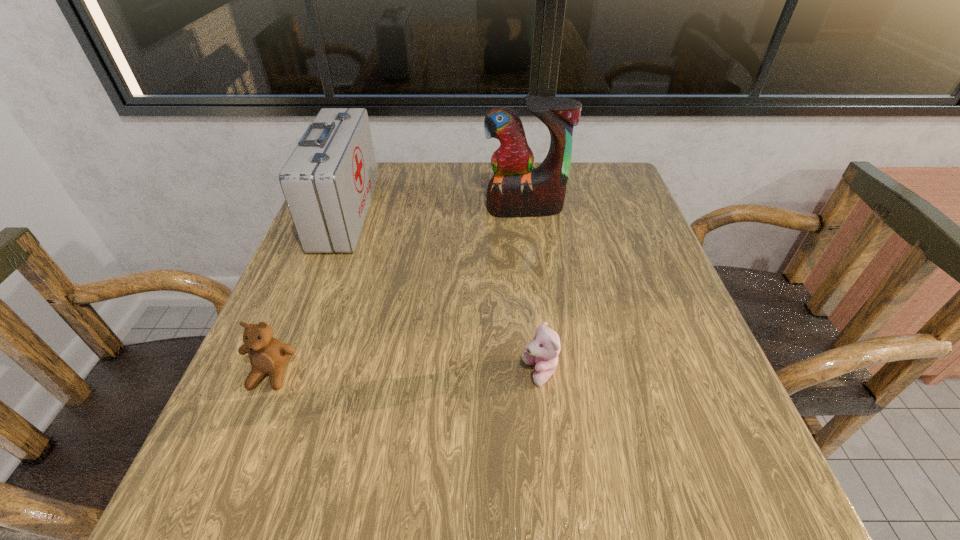
Find the location of a particular element. This screenshot has width=960, height=540. vacant space that is in between the third shortest object and the right teddy bear is located at coordinates (443, 293).

Where is `free space between the first-aid kit and the left teddy bear`? This screenshot has height=540, width=960. free space between the first-aid kit and the left teddy bear is located at coordinates click(x=308, y=293).

Where is `object that stands as the second closest to the second tallest object`? object that stands as the second closest to the second tallest object is located at coordinates (516, 190).

What are the coordinates of `the closest object relative to the first-aid kit` in the screenshot? It's located at (268, 355).

Where is `free spot that satisfies the following two spatial constraints: 1. at the face of the right teddy bear; 2. on the front-facing side of the left teddy bear`? This screenshot has width=960, height=540. free spot that satisfies the following two spatial constraints: 1. at the face of the right teddy bear; 2. on the front-facing side of the left teddy bear is located at coordinates (540, 374).

Find the location of `free space that satisfies the following two spatial constraints: 1. at the face of the tallest object; 2. at the face of the right teddy bear`. free space that satisfies the following two spatial constraints: 1. at the face of the tallest object; 2. at the face of the right teddy bear is located at coordinates (546, 373).

At what (x,y) coordinates should I click in order to perform the action: click on vacant point that satisfies the following two spatial constraints: 1. at the face of the right teddy bear; 2. on the front-facing side of the left teddy bear. Please return your answer as a coordinate pair (x, y). The image size is (960, 540). Looking at the image, I should click on (540, 374).

The height and width of the screenshot is (540, 960). What are the coordinates of `free location that satisfies the following two spatial constraints: 1. at the face of the right teddy bear; 2. on the front-facing side of the left teddy bear` in the screenshot? It's located at (540, 374).

You are a GUI agent. You are given a task and a screenshot of the screen. Output one action in this format:
    pyautogui.click(x=<x>, y=<y>)
    Task: Click on the free space that satisfies the following two spatial constraints: 1. at the face of the tallest object; 2. on the front-facing side of the first-aid kit
    The image size is (960, 540).
    Given the screenshot: What is the action you would take?
    pyautogui.click(x=525, y=213)

Locate an element on the screen. This screenshot has width=960, height=540. free space that satisfies the following two spatial constraints: 1. at the face of the tallest object; 2. on the front-facing side of the first-aid kit is located at coordinates (525, 213).